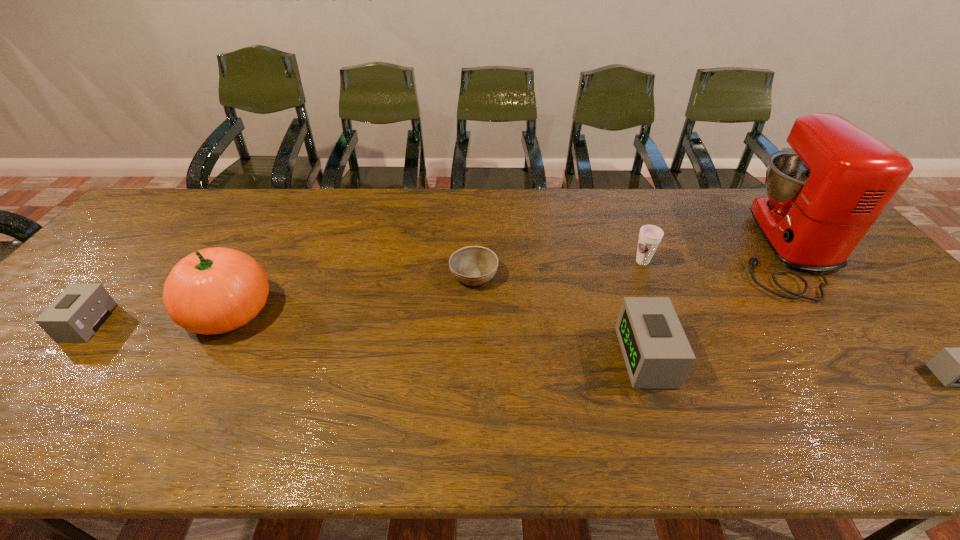
You are a GUI agent. You are given a task and a screenshot of the screen. Output one action in this format:
    pyautogui.click(x=<x>, y=<y>)
    Task: Click on the free point between the kitchen mixer and the sixth object from right to left
    The image size is (960, 540).
    Given the screenshot: What is the action you would take?
    pyautogui.click(x=505, y=280)

Locate an element on the screen. This screenshot has width=960, height=540. vacant space in between the leftmost object and the tallest object is located at coordinates (434, 286).

The image size is (960, 540). Identify the location of free area in between the leftmost object and the sixth object from right to left. (159, 317).

Find the location of a particular element. The width and height of the screenshot is (960, 540). free spot between the third shortest object and the sixth object from right to left is located at coordinates (159, 317).

Locate which object ranks in proximity to the sixth object from right to left. Please provide its 2D coordinates. Your answer should be formatted as a tuple, i.e. [(x, y)], where the tuple contains the x and y coordinates of a point satisfying the conditions above.

[(81, 309)]

Locate an element on the screen. The image size is (960, 540). object that stands as the fifth closest to the tallest object is located at coordinates (215, 290).

At what (x,y) coordinates should I click in order to perform the action: click on alarm clock that stands as the third closest to the shortest object. Please return your answer as a coordinate pair (x, y). This screenshot has height=540, width=960. Looking at the image, I should click on (955, 367).

Identify the location of the second closest alarm clock to the tallest object. (656, 351).

Find the location of a particular element. Image resolution: width=960 pixels, height=540 pixels. vacant position in the image that satisfies the following two spatial constraints: 1. on the front side of the third object from left to right; 2. on the front-facing side of the leftmost object is located at coordinates (473, 323).